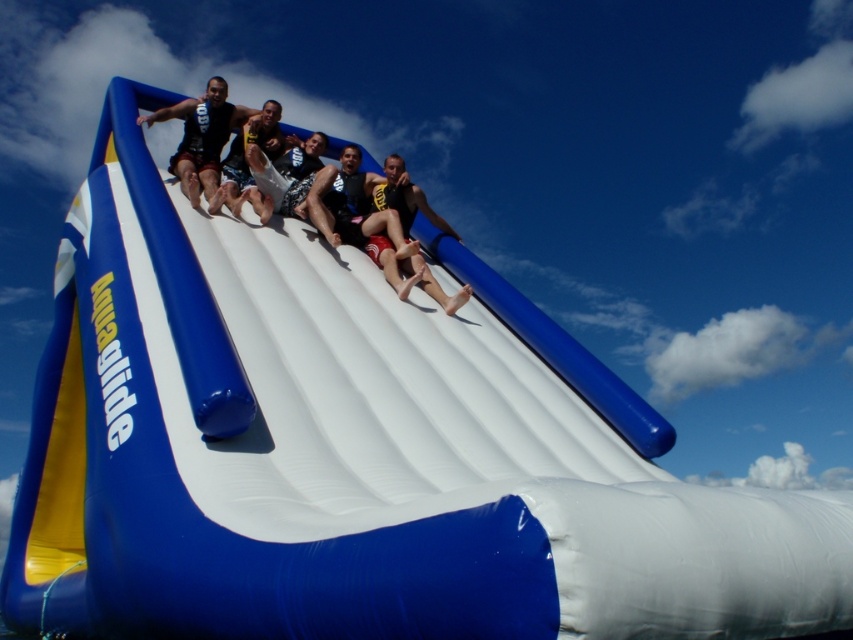
Can you confirm if matte black shorts at center is positioned to the right of matte black wetsuit at center?

Correct, you'll find matte black shorts at center to the right of matte black wetsuit at center.

Between matte black shorts at center and matte black wetsuit at center, which one is positioned higher?

matte black wetsuit at center

This screenshot has width=853, height=640. What do you see at coordinates (376, 221) in the screenshot?
I see `matte black shorts at center` at bounding box center [376, 221].

The height and width of the screenshot is (640, 853). What are the coordinates of `matte black shorts at center` in the screenshot? It's located at (376, 221).